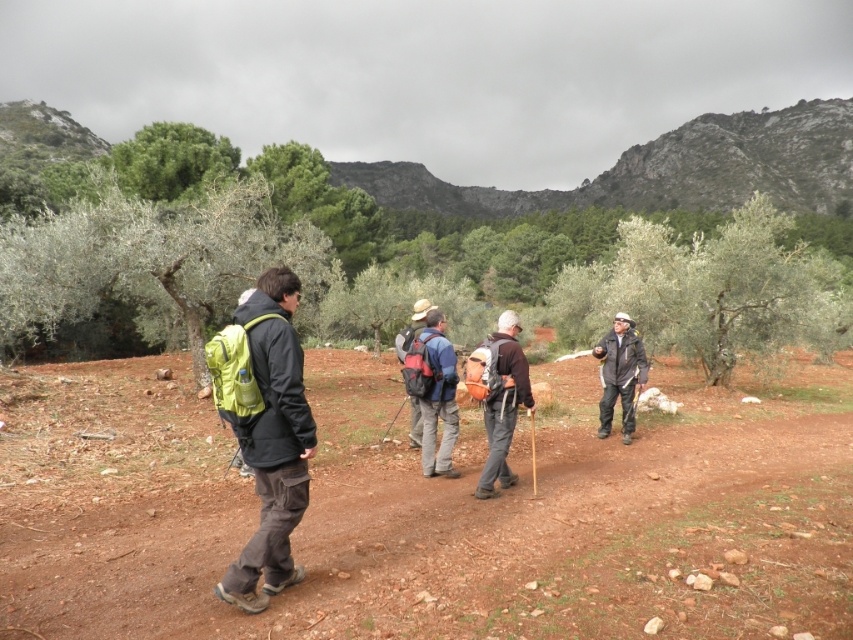
Question: Which point is closer to the camera?

Choices:
 (A) green leafy tree at center
 (B) brown dirt field at center

Answer: (B)

Question: Is green leafy tree at center smaller than green leafy tree at left?

Choices:
 (A) yes
 (B) no

Answer: (B)

Question: Is green leafy tree at left closer to the viewer compared to dark gray jacket at center?

Choices:
 (A) yes
 (B) no

Answer: (B)

Question: Which of the following is the farthest from the observer?

Choices:
 (A) red backpack at center
 (B) dark gray jacket at center

Answer: (B)

Question: Which object is positioned farthest from the matte green backpack at left?

Choices:
 (A) brown dirt field at center
 (B) red backpack at center

Answer: (B)

Question: Is green leafy tree at center bigger than orange fabric backpack at center?

Choices:
 (A) no
 (B) yes

Answer: (B)